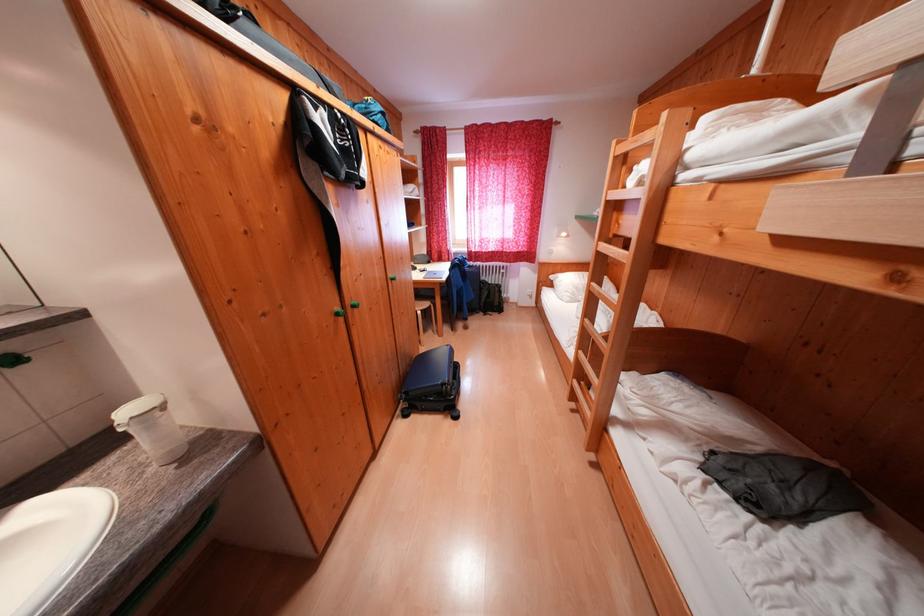
Describe the element at coordinates (432, 383) in the screenshot. Image resolution: width=924 pixels, height=616 pixels. I see `a blue suitcase` at that location.